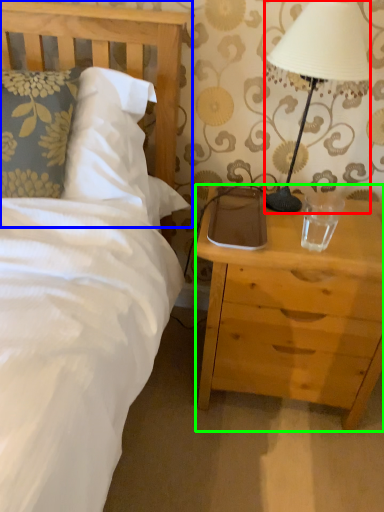
Question: Which object is positioned farthest from lamp (highlighted by a red box)? Select from headboard (highlighted by a blue box) and nightstand (highlighted by a green box).

Choices:
 (A) headboard
 (B) nightstand

Answer: (A)